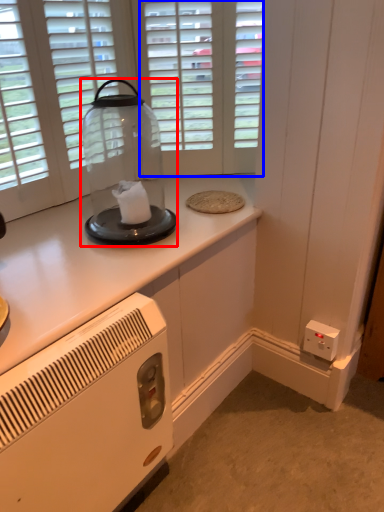
Question: Which object appears closest to the camera in this image, glass jar (highlighted by a red box) or glass door (highlighted by a blue box)?

Choices:
 (A) glass jar
 (B) glass door

Answer: (A)